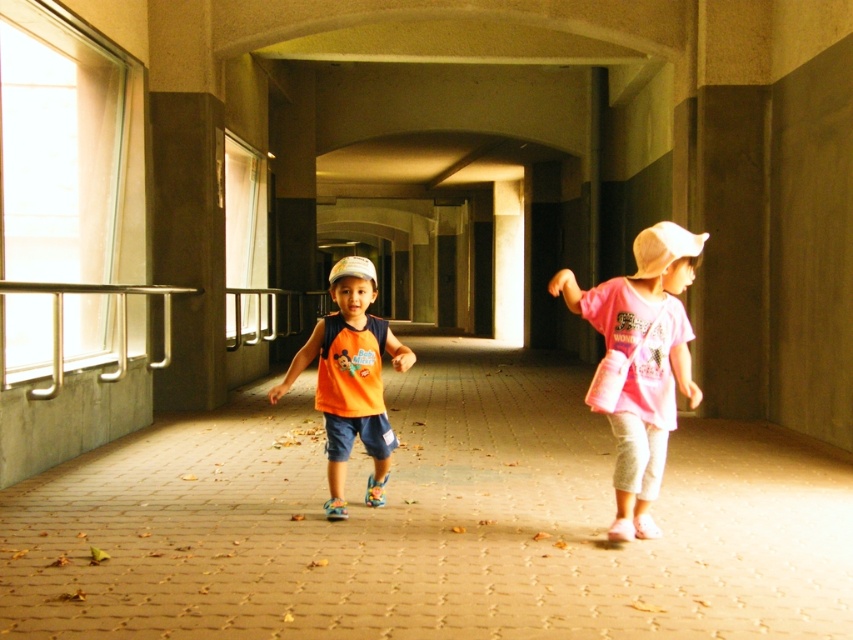
Question: Which point appears closest to the camera in this image?

Choices:
 (A) (749, 472)
 (B) (335, 342)
 (C) (635, 256)

Answer: (C)

Question: Is pink cotton shirt at right to the right of orange matte tank top at center from the viewer's perspective?

Choices:
 (A) yes
 (B) no

Answer: (A)

Question: Does pink cotton shirt at right have a lesser width compared to orange matte tank top at center?

Choices:
 (A) yes
 (B) no

Answer: (B)

Question: Is the position of brown brick pavement at center more distant than that of orange matte tank top at center?

Choices:
 (A) yes
 (B) no

Answer: (B)

Question: Which object is positioned farthest from the orange matte tank top at center?

Choices:
 (A) brown brick pavement at center
 (B) pink cotton shirt at right

Answer: (A)

Question: Which point is closer to the camera?

Choices:
 (A) orange matte tank top at center
 (B) brown brick pavement at center
 (C) pink cotton shirt at right

Answer: (B)